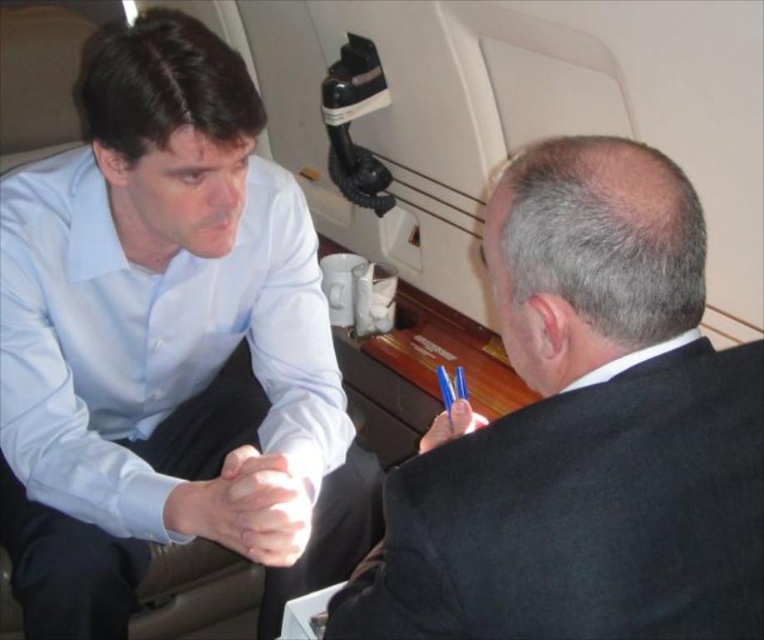
Question: Does light blue shirt at upper left have a larger size compared to black matte suit at right?

Choices:
 (A) no
 (B) yes

Answer: (B)

Question: Is light blue shirt at upper left further to camera compared to black matte suit at right?

Choices:
 (A) no
 (B) yes

Answer: (B)

Question: Is light blue shirt at upper left positioned before black matte suit at right?

Choices:
 (A) yes
 (B) no

Answer: (B)

Question: Which of the following is the closest to the observer?

Choices:
 (A) (73, 582)
 (B) (610, 170)

Answer: (B)

Question: Which point appears closest to the camera in this image?

Choices:
 (A) (465, 476)
 (B) (60, 353)

Answer: (A)